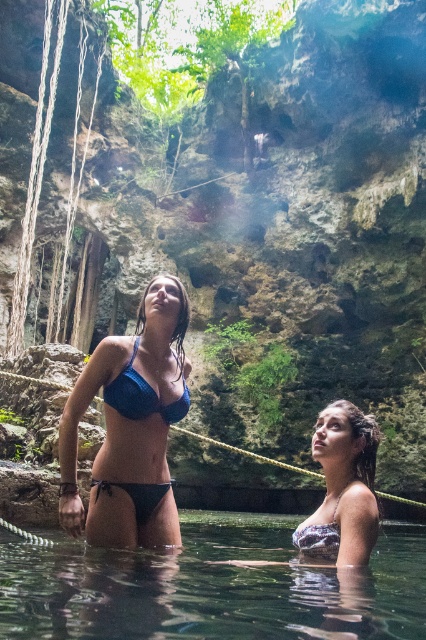
Question: Does blue matte bikini at center have a smaller size compared to blue sequined bikini top at center?

Choices:
 (A) yes
 (B) no

Answer: (B)

Question: Which point is closer to the camera taking this photo?

Choices:
 (A) (357, 522)
 (B) (330, 525)
 (C) (152, 416)
 (D) (255, 580)

Answer: (A)

Question: Is blue sequined bikini top at center smaller than white lace bikini at lower center?

Choices:
 (A) yes
 (B) no

Answer: (B)

Question: Can you confirm if clear water at lower center is positioned to the left of white lace bikini at lower center?

Choices:
 (A) no
 (B) yes

Answer: (B)

Question: Which object is closer to the camera taking this photo?

Choices:
 (A) clear water at lower center
 (B) patterned fabric bikini top at lower center

Answer: (B)

Question: Which point is farther from the camera taking this photo?

Choices:
 (A) (324, 531)
 (B) (354, 481)
 (C) (321, 612)

Answer: (B)